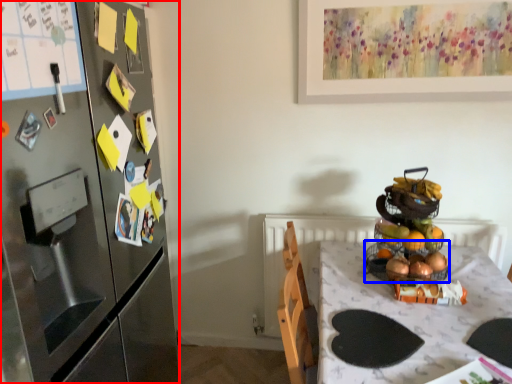
Question: Which point is closer to the camera, cabinetry (highlighted by a red box) or basket (highlighted by a blue box)?

Choices:
 (A) cabinetry
 (B) basket

Answer: (A)